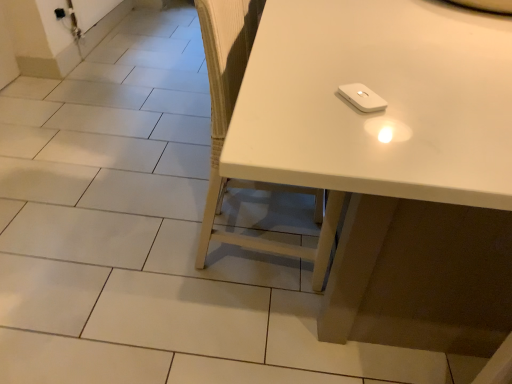
Find the location of a particular element. The width and height of the screenshot is (512, 384). free area behind white matte wii controller at upper center is located at coordinates (352, 70).